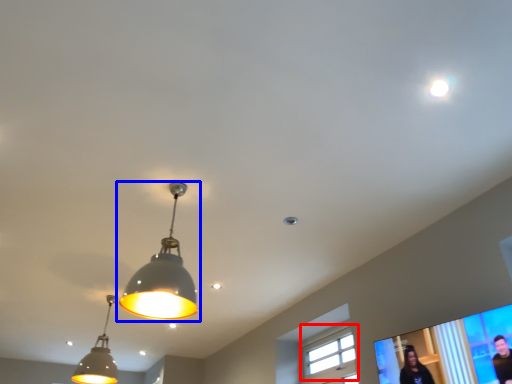
Question: Which object appears closest to the camera in this image, window (highlighted by a red box) or lamp (highlighted by a blue box)?

Choices:
 (A) window
 (B) lamp

Answer: (B)